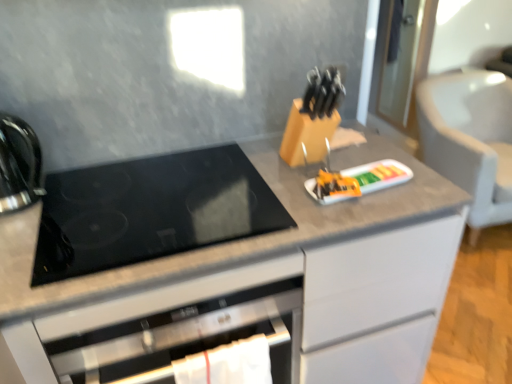
Locate an element on the screen. Image resolution: width=512 pixels, height=384 pixels. vacant area that is situated to the right of orange plastic tray at center is located at coordinates (418, 180).